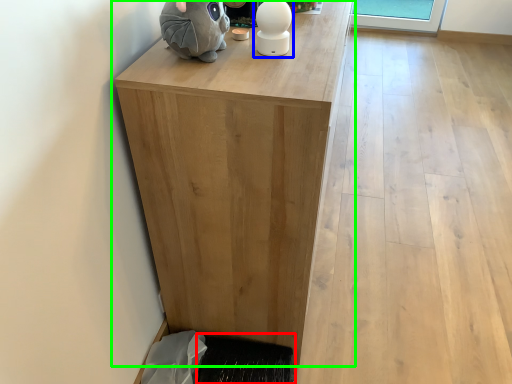
Question: Based on their relative distances, which object is nearer to doormat (highlighted by a red box)? Choose from figurine (highlighted by a blue box) and table (highlighted by a green box).

Choices:
 (A) figurine
 (B) table

Answer: (B)